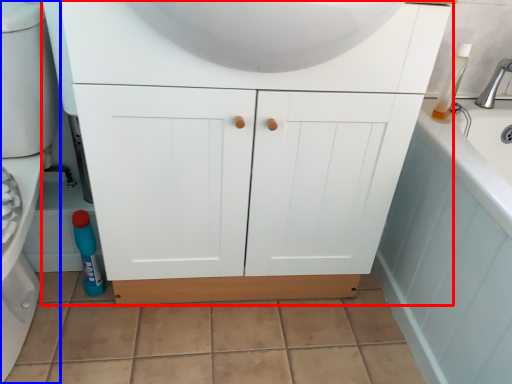
Question: Which point is closer to the camera, bathroom cabinet (highlighted by a red box) or porcelain (highlighted by a blue box)?

Choices:
 (A) bathroom cabinet
 (B) porcelain

Answer: (B)